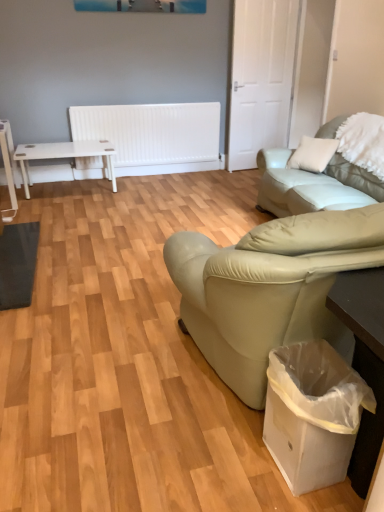
You are a GUI agent. You are given a task and a screenshot of the screen. Output one action in this format:
    pyautogui.click(x=<x>, y=<y>)
    Task: Click on the vacant region to the left of white plastic bag at lower right
    The height and width of the screenshot is (512, 384).
    Given the screenshot: What is the action you would take?
    pyautogui.click(x=237, y=466)